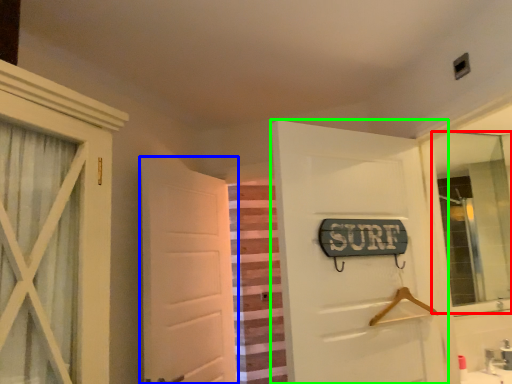
Question: Which is farther away from mirror (highlighted by a red box)? door (highlighted by a blue box) or door (highlighted by a green box)?

Choices:
 (A) door
 (B) door

Answer: (A)